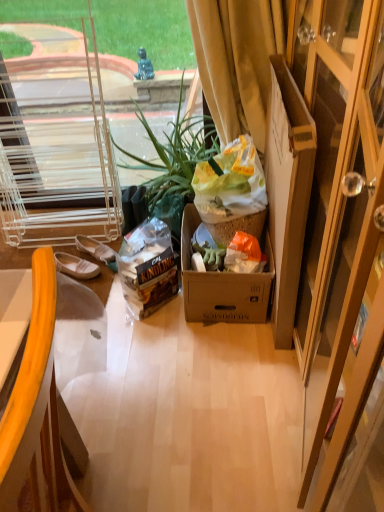
Question: From a real-world perspective, is yellow velvet curtain at upper right physically located above or below white fabric shoe at left?

Choices:
 (A) below
 (B) above

Answer: (B)

Question: Visually, is yellow velvet curtain at upper right positioned to the left or to the right of white fabric shoe at left?

Choices:
 (A) right
 (B) left

Answer: (A)

Question: Estimate the real-world distances between objects in this image. Which object is farther from the green leafy plant at center?

Choices:
 (A) yellow plastic chair at left
 (B) cardboard box at right
 (C) white canvas slipper at lower left
 (D) white fabric shoe at left
 (E) yellow velvet curtain at upper right

Answer: (A)

Question: Considering the real-world distances, which object is farthest from the yellow velvet curtain at upper right?

Choices:
 (A) cardboard box at right
 (B) white canvas slipper at lower left
 (C) green leafy plant at center
 (D) white fabric shoe at left
 (E) yellow plastic chair at left

Answer: (E)